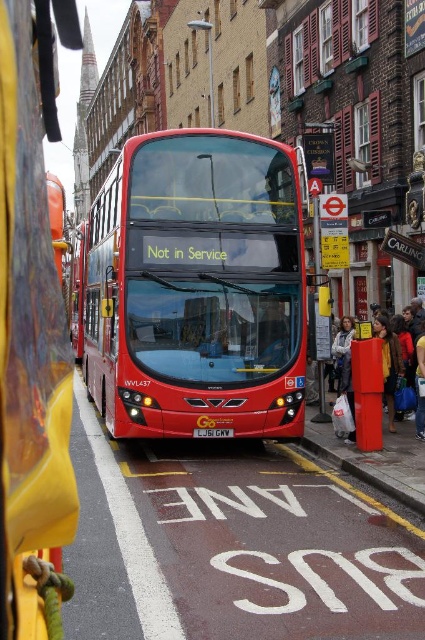
In order to click on shiny red bus at center in this screenshot , I will do `click(197, 288)`.

Which is in front, point (232, 340) or point (374, 376)?

Point (232, 340) is in front.

Is point (282, 152) positioned behind point (402, 378)?

No.

Find the location of a particular element. shiny red bus at center is located at coordinates (197, 288).

Measure the distance from red plastic box at right to yellow metallic license plate at center.

red plastic box at right and yellow metallic license plate at center are 3.63 meters apart from each other.

Does red plastic box at right appear on the left side of yellow metallic license plate at center?

No, red plastic box at right is not to the left of yellow metallic license plate at center.

Is point (380, 356) positioned in front of point (226, 433)?

No, (380, 356) is behind (226, 433).

This screenshot has height=640, width=425. I want to click on red plastic box at right, so click(x=393, y=369).

Which is more to the left, shiny red bus at center or yellow metallic license plate at center?

Positioned to the left is shiny red bus at center.

Is shiny red bus at center bigger than yellow metallic license plate at center?

Yes.

Is point (176, 362) behind point (224, 433)?

That is False.

This screenshot has height=640, width=425. I want to click on shiny red bus at center, so click(197, 288).